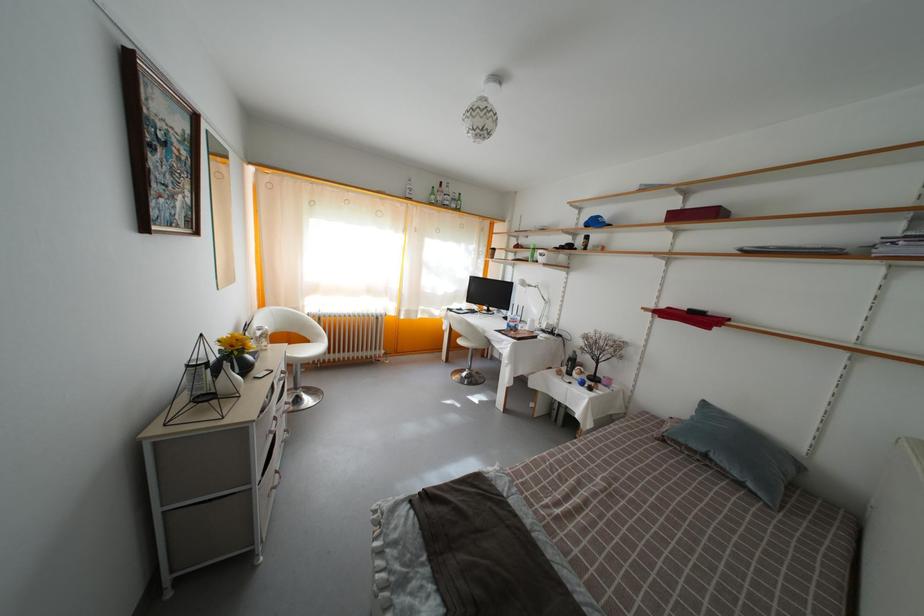
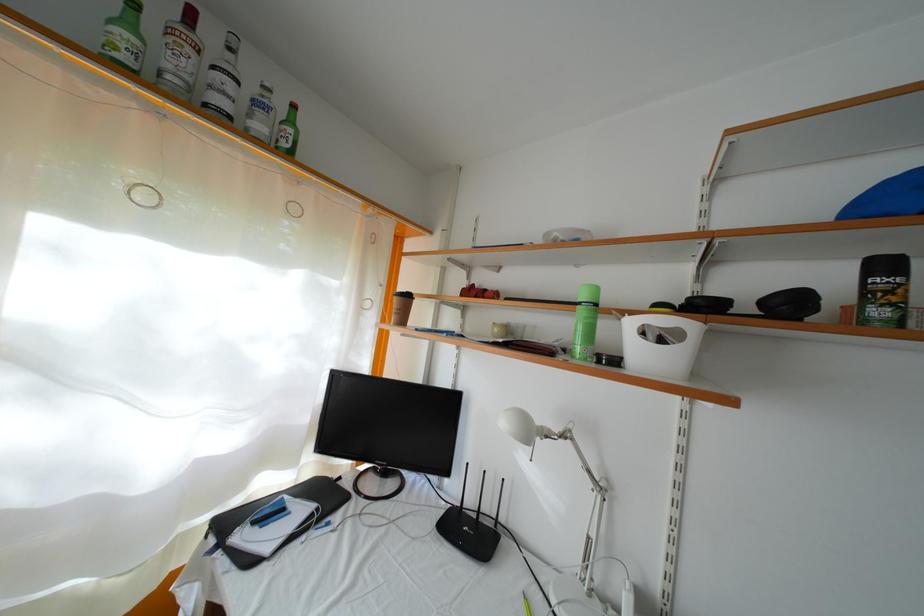
The point at (466, 206) is marked in the first image. Where is the corresponding point in the second image?

(297, 128)